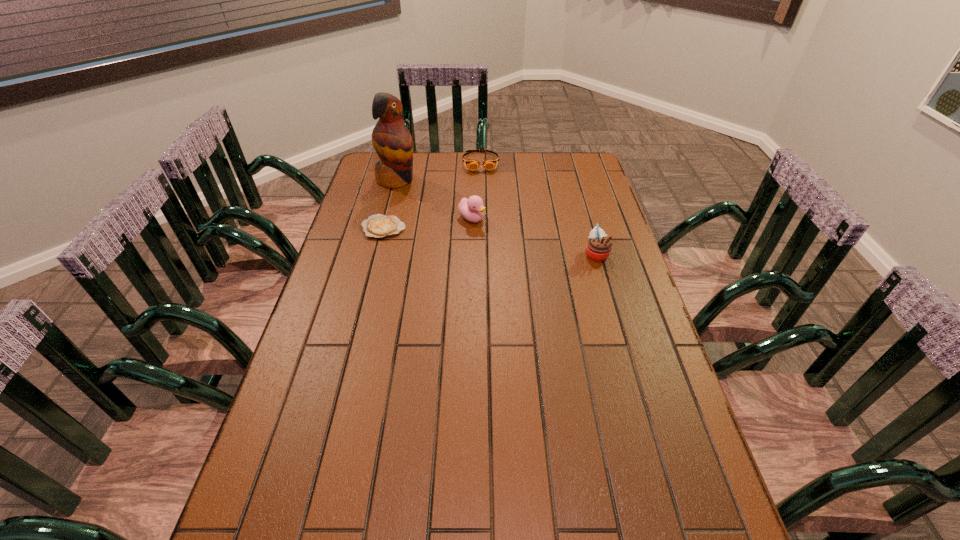
Find the location of a particular element. The image size is (960, 540). vacant space on the desktop that is between the quiche and the rightmost object and is positioned on the front-facing side of the duckling is located at coordinates (516, 244).

Find the location of `vacant space on the desktop that is between the quiche and the rightmost object and is positioned on the face of the parrot`. vacant space on the desktop that is between the quiche and the rightmost object and is positioned on the face of the parrot is located at coordinates (509, 243).

This screenshot has height=540, width=960. I want to click on free space on the desktop that is between the shortest object and the rightmost object and is positioned with the lenses facing forward on the goggles, so click(x=488, y=241).